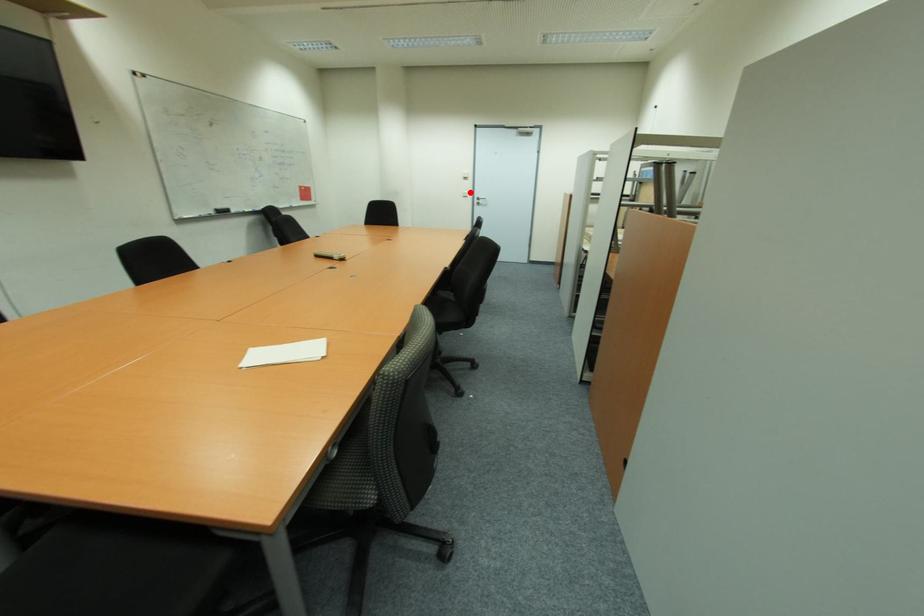
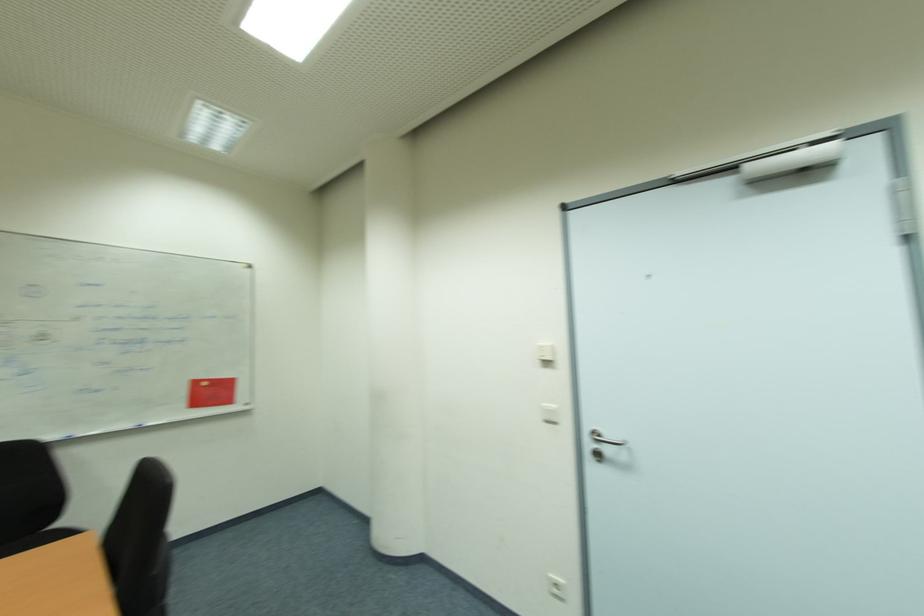
Question: I am providing you with two images of the same scene from different viewpoints. A red point is marked on the first image. At the location where the point appears in image 1, is it still visible in image 2?

Choices:
 (A) Yes
 (B) No

Answer: (A)